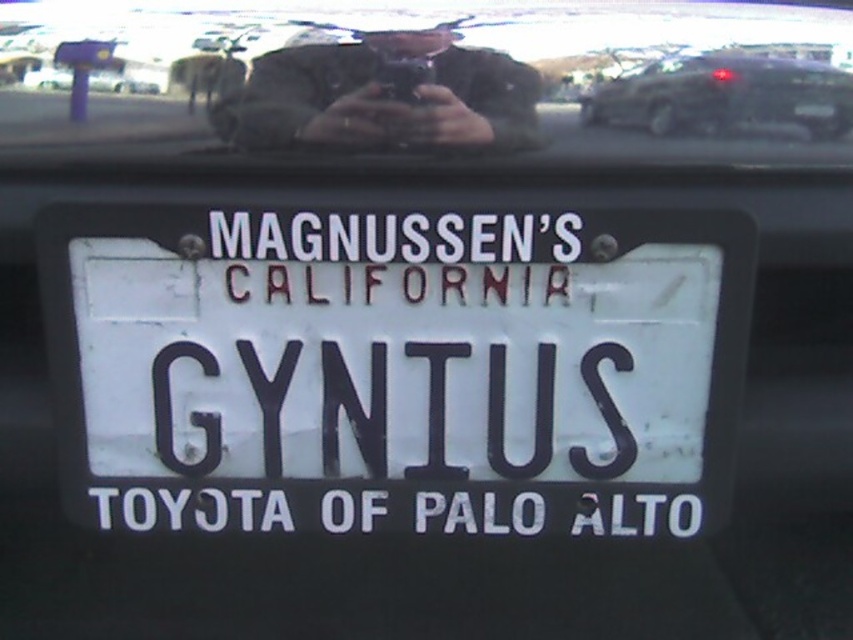
Based on the photo, you are a driver looking at the license plate on the car in front of you. You notice a point at coordinates (397, 369). What object is located at that point?

The point at coordinates (397, 369) is occupied by the white matte license plate at center.

You are driving and need to check the rearview mirror. Is the point marked by point (434, 68) obstructed by any object?

The transparent glass at center represented by point (434, 68) is not obstructed by any object as there are no objects mentioned in the scene description that would block it.

You are a photographer trying to capture both the matte black phone at upper center and the metallic dark gray suv at upper right in your shot. Based on their positions, which object should you adjust your camera to focus on first to ensure both are in frame?

The matte black phone at upper center is to the left of the metallic dark gray suv at upper right, so you should focus on the left side first to include both objects in the frame.